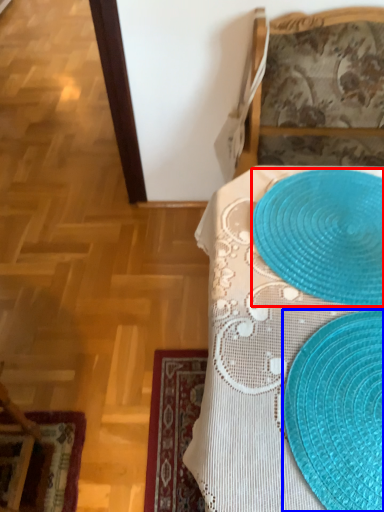
Question: Which point is further to the camera, platter (highlighted by a red box) or straw hat (highlighted by a blue box)?

Choices:
 (A) platter
 (B) straw hat

Answer: (A)